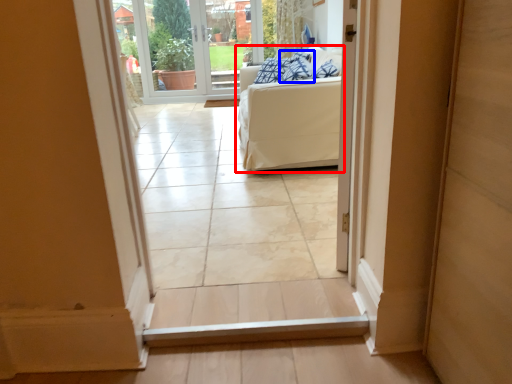
Question: Which object is further to the camera taking this photo, studio couch (highlighted by a red box) or pillow (highlighted by a blue box)?

Choices:
 (A) studio couch
 (B) pillow

Answer: (B)